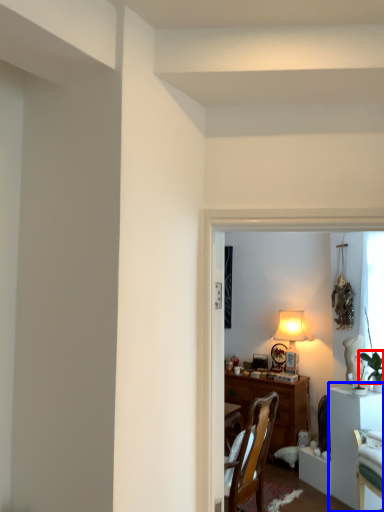
Question: Among these objects, which one is farthest to the camera, plant (highlighted by a red box) or table (highlighted by a blue box)?

Choices:
 (A) plant
 (B) table

Answer: (A)